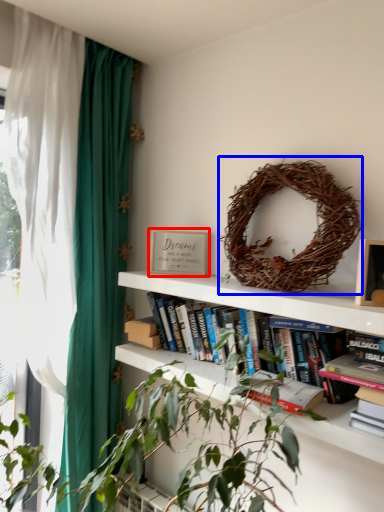
Question: Which object appears closest to the camera in this image, paperback book (highlighted by a red box) or bird nest (highlighted by a blue box)?

Choices:
 (A) paperback book
 (B) bird nest

Answer: (B)